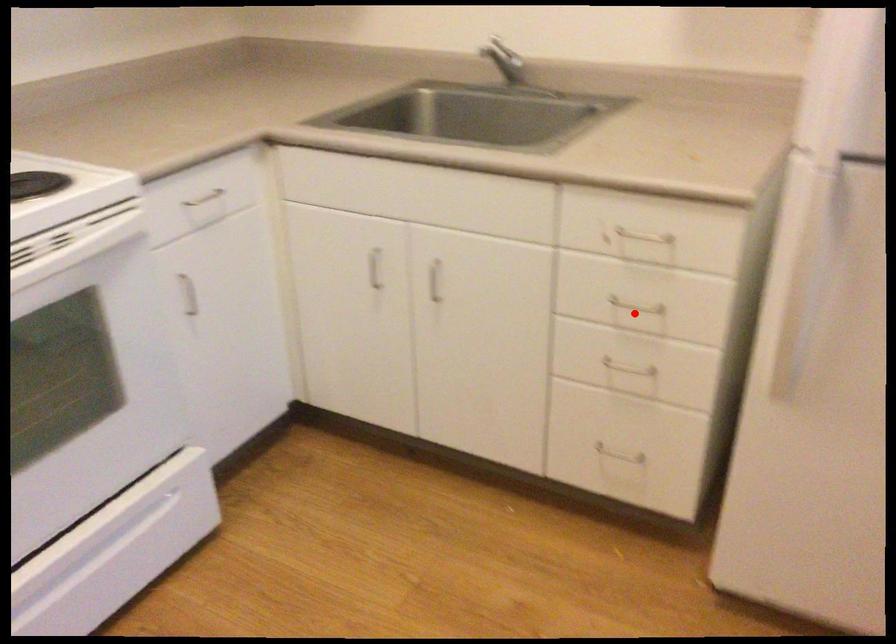
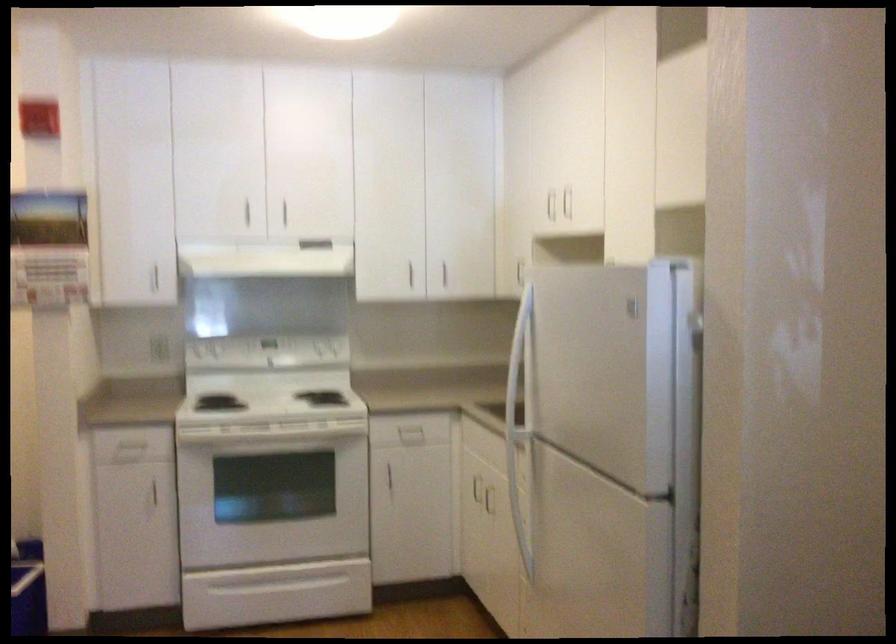
Question: I am providing you with two images of the same scene from different viewpoints. A red point is marked on the first image. At the location where the point appears in image 1, is it still visible in image 2?

Choices:
 (A) Yes
 (B) No

Answer: (B)